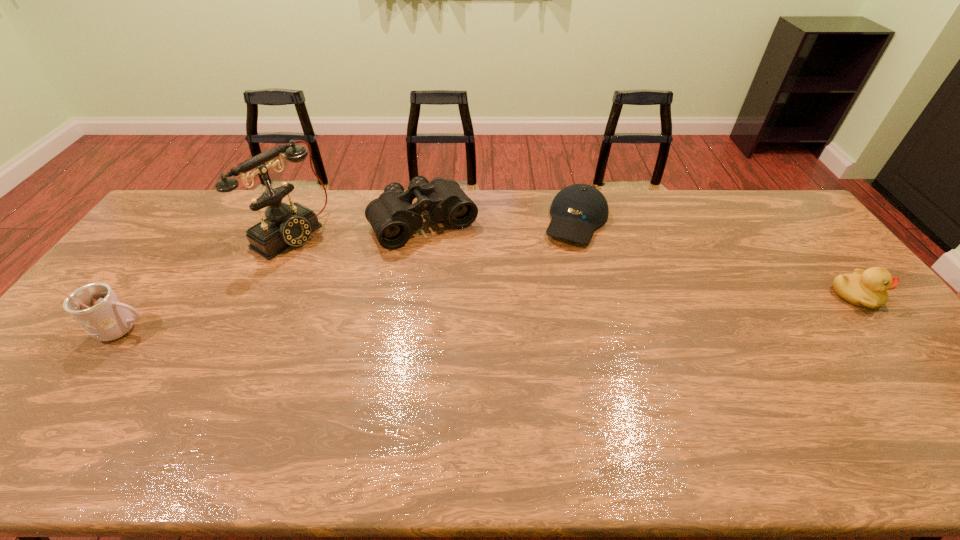
Locate an element on the screen. The height and width of the screenshot is (540, 960). free space between the cup and the second object from right to left is located at coordinates (349, 275).

Locate an element on the screen. This screenshot has width=960, height=540. blank region between the duckling and the binoculars is located at coordinates (639, 260).

Locate an element on the screen. vacant space that's between the rightmost object and the nearest object is located at coordinates (490, 313).

In order to click on free point between the second object from right to left and the telephone in this screenshot , I will do pyautogui.click(x=433, y=227).

I want to click on free spot between the tallest object and the baseball cap, so click(x=433, y=227).

Identify the location of free point between the baseball cap and the rightmost object. Image resolution: width=960 pixels, height=540 pixels. (716, 258).

The height and width of the screenshot is (540, 960). I want to click on free space between the telephone and the leftmost object, so click(x=206, y=281).

Locate an element on the screen. This screenshot has width=960, height=540. empty location between the tallest object and the baseball cap is located at coordinates (433, 227).

Where is `vacant point located between the third shortest object and the rightmost object`? Image resolution: width=960 pixels, height=540 pixels. vacant point located between the third shortest object and the rightmost object is located at coordinates (639, 260).

Where is `free spot between the baseball cap and the telephone`? free spot between the baseball cap and the telephone is located at coordinates (433, 227).